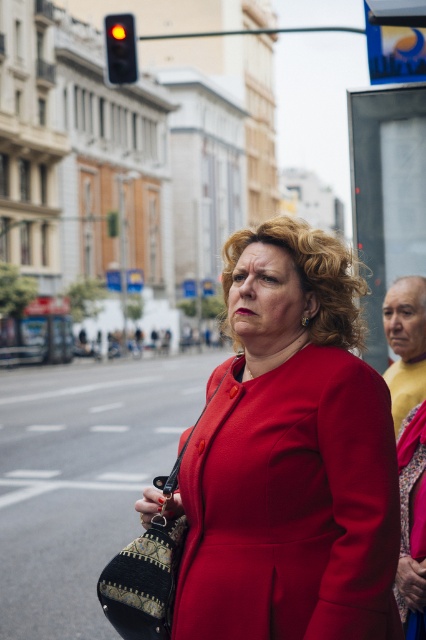
Question: Which of the following is the farthest from the observer?

Choices:
 (A) (419, 440)
 (B) (420, 358)

Answer: (B)

Question: Among these objects, which one is farthest from the camera?

Choices:
 (A) red glass traffic light at upper left
 (B) smooth yellow shirt at right
 (C) matte red coat at center
 (D) velvet red dress at center

Answer: (A)

Question: Does velvet red dress at center appear on the right side of red glass traffic light at upper left?

Choices:
 (A) no
 (B) yes

Answer: (B)

Question: Does matte red coat at center have a greater width compared to velvet red dress at center?

Choices:
 (A) no
 (B) yes

Answer: (B)

Question: Is matte red coat at center smaller than velvet red dress at center?

Choices:
 (A) no
 (B) yes

Answer: (A)

Question: Which point appears closest to the camera in this image?

Choices:
 (A) (307, 419)
 (B) (126, 72)

Answer: (A)